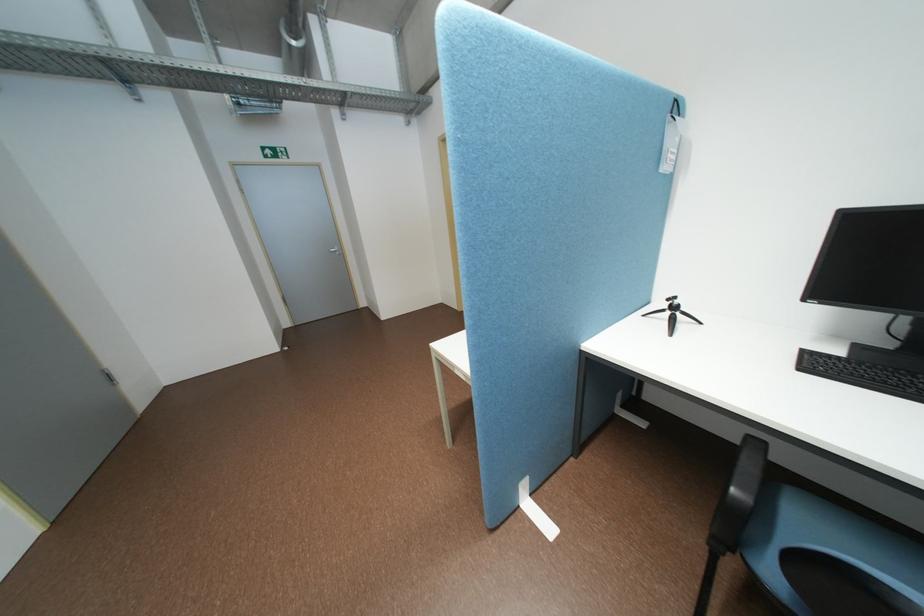
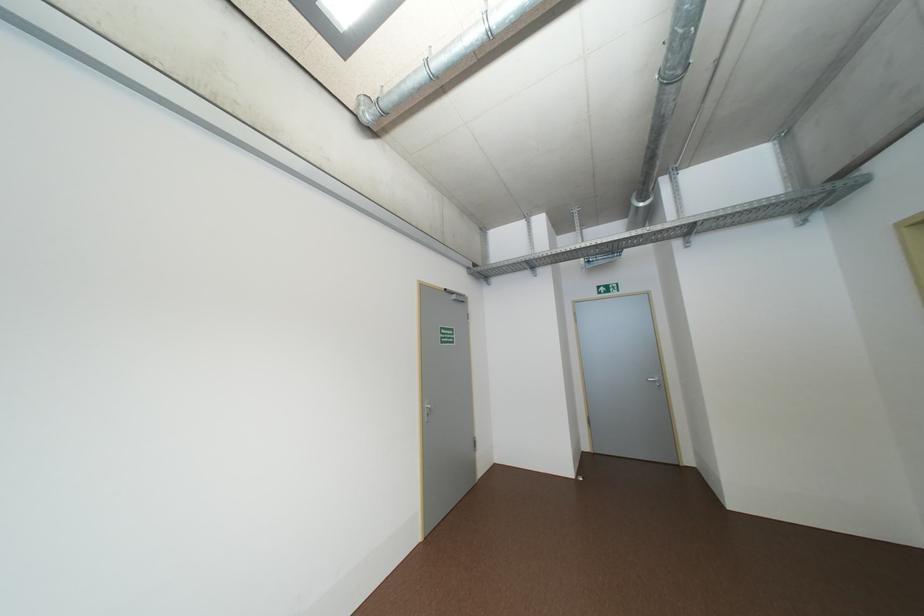
Question: The camera is either moving clockwise (left) or counter-clockwise (right) around the object. The first image is from the beginning of the video and the second image is from the end. Is the camera moving left or right when shooting the video?

Choices:
 (A) Left
 (B) Right

Answer: (B)